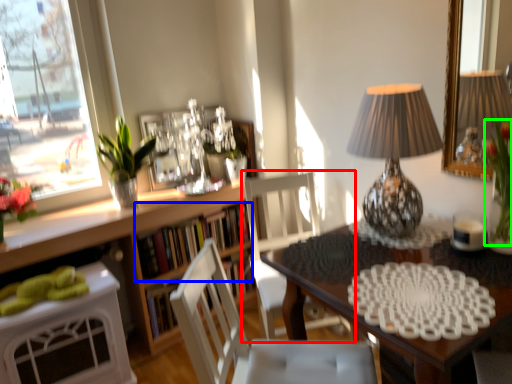
Question: Which object is the farthest from chair (highlighted by a red box)? Choose among these: book (highlighted by a blue box) or floral arrangement (highlighted by a green box).

Choices:
 (A) book
 (B) floral arrangement

Answer: (B)